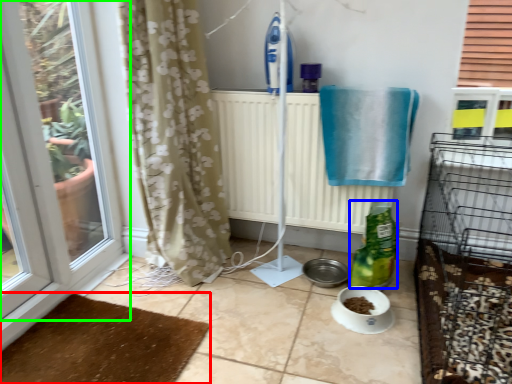
Question: Which is nearer to the doormat (highlighted by a red box)? bottle (highlighted by a blue box) or window (highlighted by a green box).

Choices:
 (A) bottle
 (B) window

Answer: (B)